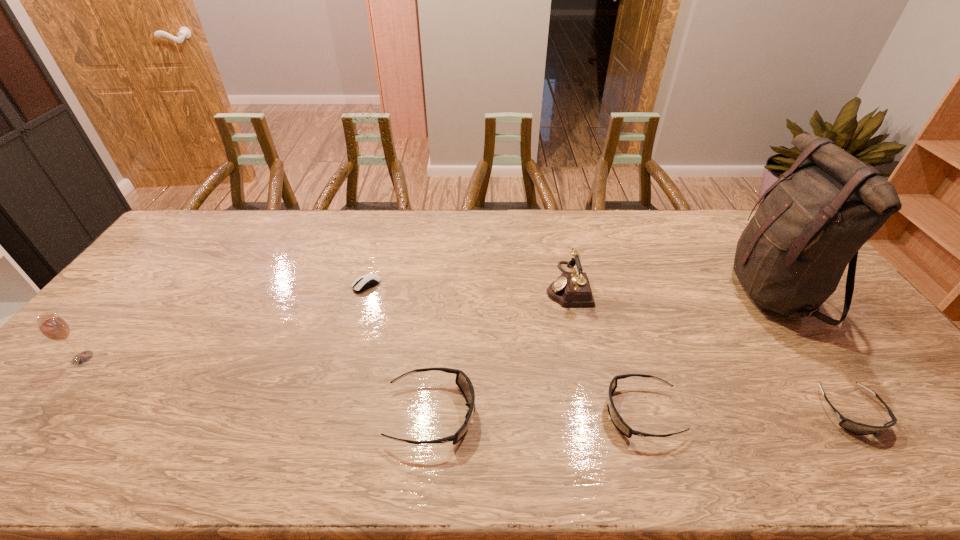
I want to click on free space at the left edge of the desktop, so click(x=171, y=295).

The image size is (960, 540). I want to click on free space at the right edge, so click(x=818, y=339).

This screenshot has height=540, width=960. Identify the location of vacant point located between the telephone and the tallest object. (670, 288).

The image size is (960, 540). Identify the location of unoccupied position between the leftmost goggles and the rightmost goggles. (641, 413).

Image resolution: width=960 pixels, height=540 pixels. I want to click on free space between the fifth shortest object and the third object from left to right, so click(x=499, y=349).

Where is `unoccupied position between the shortest goggles and the telephone`? unoccupied position between the shortest goggles and the telephone is located at coordinates (708, 348).

Where is `vacant area that lies between the wineglass and the backpack`? This screenshot has width=960, height=540. vacant area that lies between the wineglass and the backpack is located at coordinates (428, 325).

This screenshot has width=960, height=540. In order to click on free area in between the leftmost goggles and the second object from left to right in this screenshot , I will do `click(399, 349)`.

Identify the location of free point between the backpack and the fourth nearest object. [428, 325].

At what (x,y) coordinates should I click in order to perform the action: click on unoccupied area between the mouse and the fifth shortest object. Please return your answer as a coordinate pair (x, y). This screenshot has height=540, width=960. Looking at the image, I should click on (467, 285).